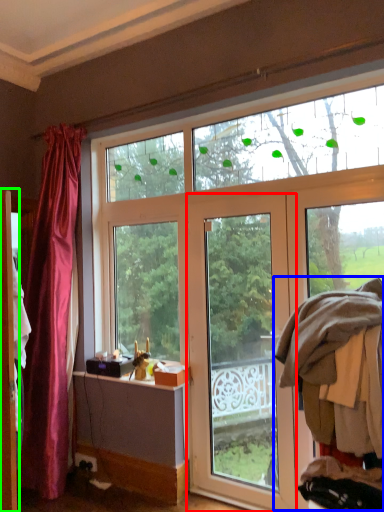
Question: Which object is the farthest from door (highlighted by a red box)? Choose among these: laundry (highlighted by a blue box) or screen door (highlighted by a green box).

Choices:
 (A) laundry
 (B) screen door

Answer: (B)